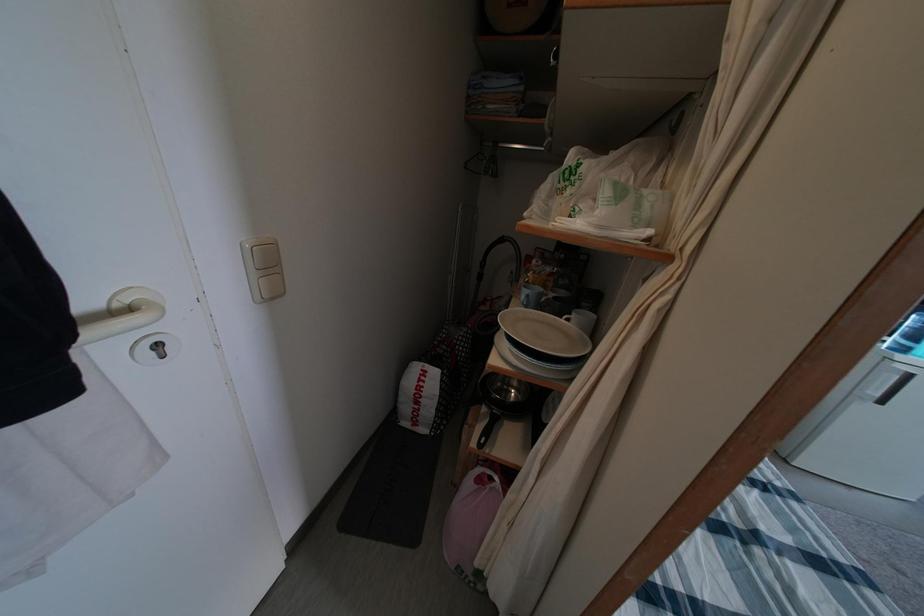
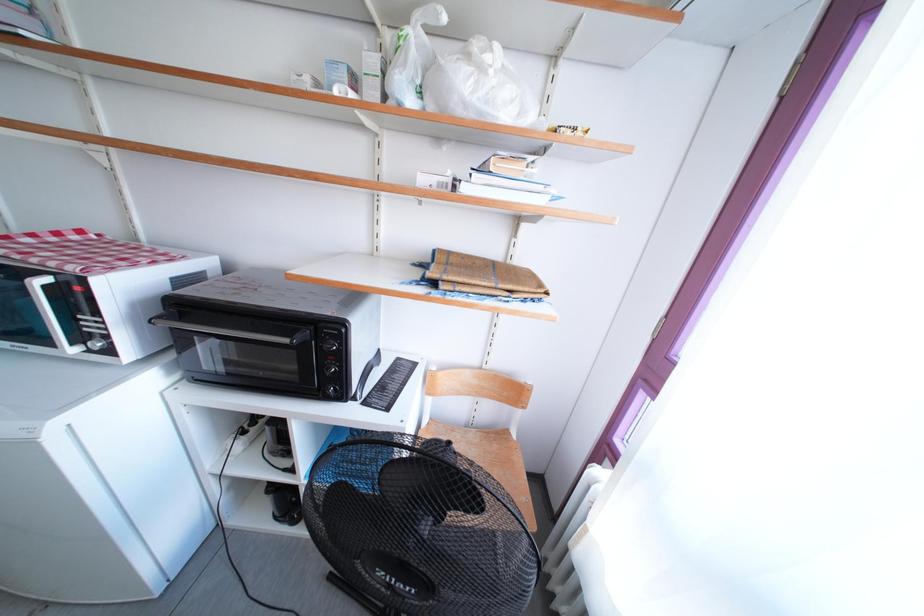
Question: In a continuous first-person perspective shot, in which direction is the camera moving?

Choices:
 (A) Left
 (B) Right
 (C) Forward
 (D) Backward

Answer: (B)